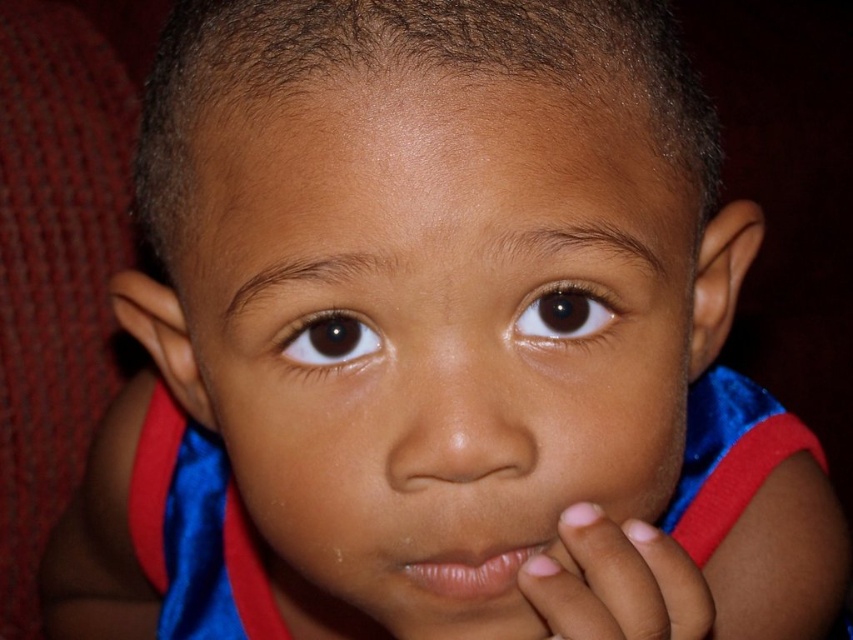
Question: Does brown shiny eye at upper center have a smaller size compared to brown shiny eye at center?

Choices:
 (A) no
 (B) yes

Answer: (A)

Question: Which of the following is the farthest from the observer?

Choices:
 (A) pink smooth lips at center
 (B) smooth skin nose at center
 (C) smooth skin face at center

Answer: (A)

Question: Which object is closer to the camera taking this photo?

Choices:
 (A) pink smooth lips at center
 (B) brown shiny eye at upper center
 (C) smooth skin face at center
 (D) smooth skin hand at lower center

Answer: (C)

Question: Does smooth skin face at center have a greater width compared to smooth skin hand at lower center?

Choices:
 (A) yes
 (B) no

Answer: (A)

Question: Which of these objects is positioned farthest from the smooth skin hand at lower center?

Choices:
 (A) brown shiny eye at upper center
 (B) smooth skin nose at center
 (C) pink smooth lips at center
 (D) brown shiny eye at center

Answer: (D)

Question: Considering the relative positions of smooth skin hand at lower center and brown shiny eye at center in the image provided, where is smooth skin hand at lower center located with respect to brown shiny eye at center?

Choices:
 (A) right
 (B) left

Answer: (A)